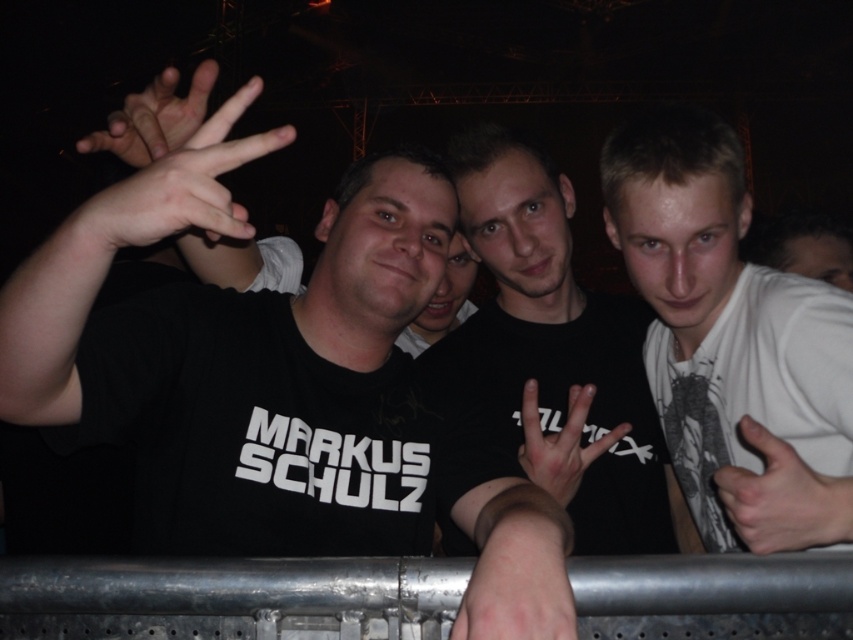
Question: Considering the real-world distances, which object is closest to the white matte shirt at right?

Choices:
 (A) smooth black hand at center
 (B) matte black hand at upper left
 (C) black matte shirt at center
 (D) black matte t-shirt at center

Answer: (C)

Question: Which of these objects is positioned farthest from the smooth black hand at center?

Choices:
 (A) black matte t-shirt at center
 (B) white matte shirt at right
 (C) black matte shirt at center
 (D) matte skin hand at center

Answer: (D)

Question: Is black matte t-shirt at center smaller than white matte hand at center?

Choices:
 (A) yes
 (B) no

Answer: (B)

Question: Does white matte hand at center have a smaller size compared to matte black hand at upper left?

Choices:
 (A) no
 (B) yes

Answer: (B)

Question: Does black matte shirt at center appear on the right side of matte black hand at upper left?

Choices:
 (A) no
 (B) yes

Answer: (B)

Question: Among these objects, which one is farthest from the camera?

Choices:
 (A) matte black hand at upper left
 (B) matte skin hand at center

Answer: (A)